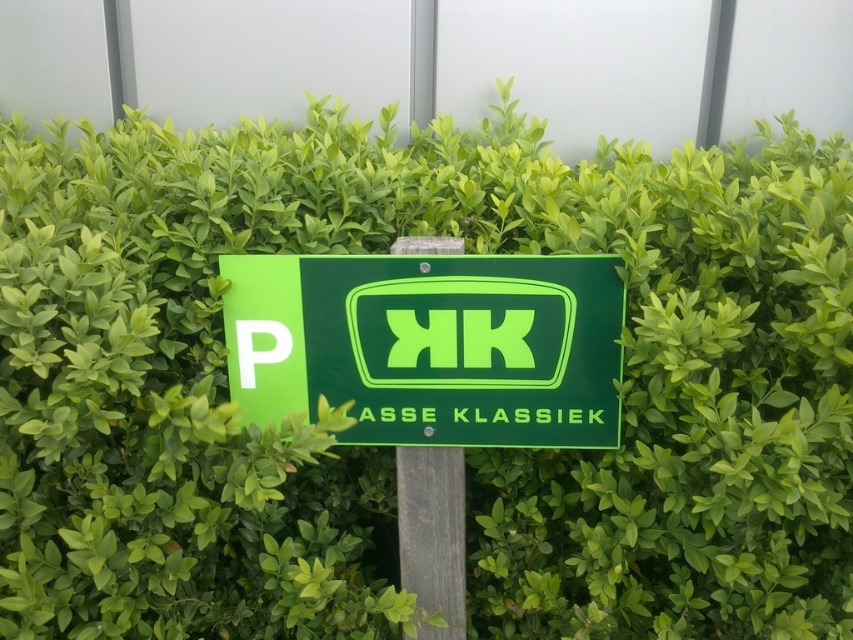
Question: Among these objects, which one is farthest from the camera?

Choices:
 (A) wooden post at center
 (B) neon green plastic sign at center

Answer: (A)

Question: Can you confirm if neon green plastic sign at center is thinner than wooden post at center?

Choices:
 (A) yes
 (B) no

Answer: (B)

Question: Is neon green plastic sign at center wider than wooden post at center?

Choices:
 (A) no
 (B) yes

Answer: (B)

Question: Which of the following is the closest to the observer?

Choices:
 (A) wooden post at center
 (B) neon green plastic sign at center

Answer: (B)

Question: Is neon green plastic sign at center above wooden post at center?

Choices:
 (A) no
 (B) yes

Answer: (B)